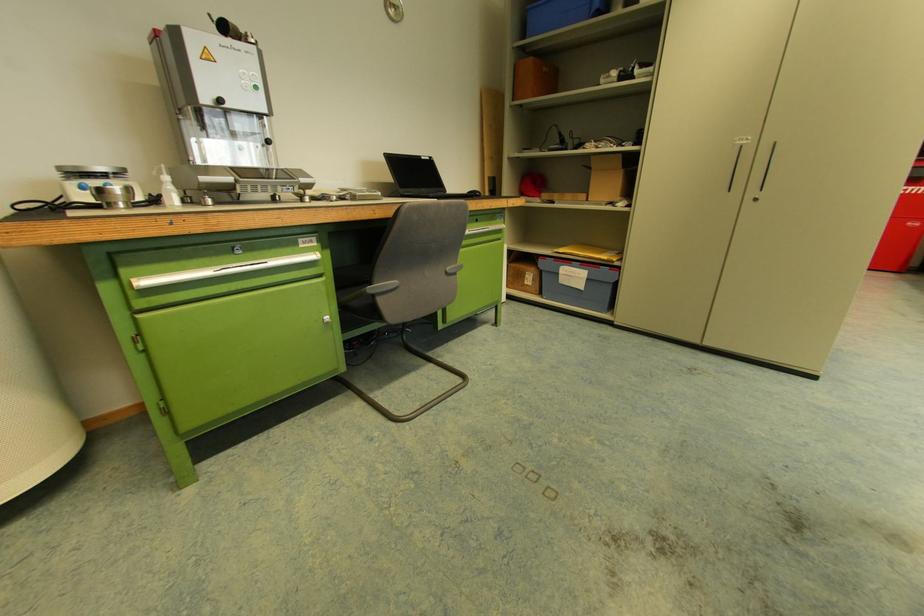
What do you see at coordinates (220, 270) in the screenshot? This screenshot has height=616, width=924. I see `the recessed drawer handle` at bounding box center [220, 270].